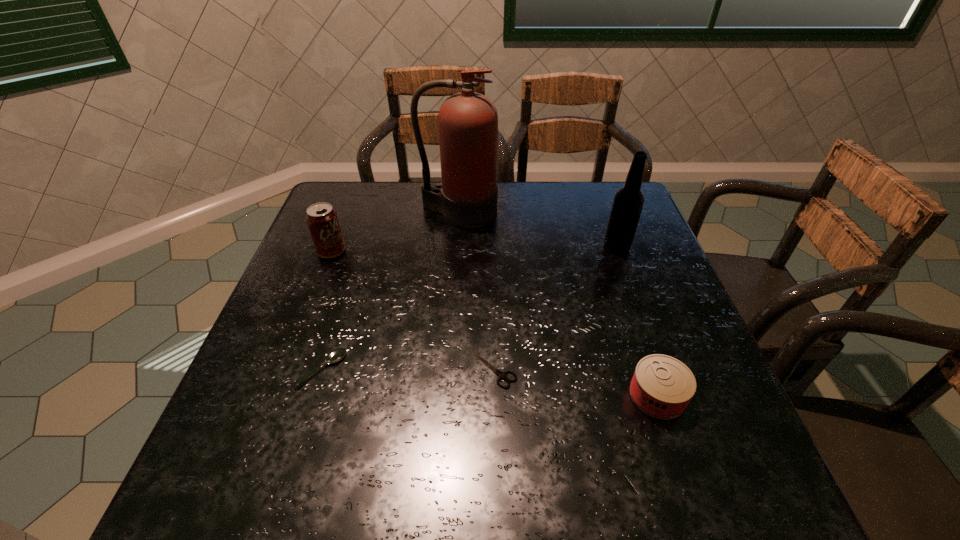
Where is `empty space between the third tallest object and the soupspoon`? empty space between the third tallest object and the soupspoon is located at coordinates (327, 310).

Locate an element on the screen. The height and width of the screenshot is (540, 960). vacant area that lies between the can and the third tallest object is located at coordinates (494, 323).

Locate an element on the screen. The image size is (960, 540). vacant area that lies between the can and the farthest object is located at coordinates (558, 303).

Where is `vacant space that's between the tallest object and the can`? vacant space that's between the tallest object and the can is located at coordinates (558, 303).

The width and height of the screenshot is (960, 540). What are the coordinates of `free space between the shortest object and the fourth tallest object` in the screenshot? It's located at (575, 382).

Where is `vacant space that is in between the soupspoon and the second tallest object`? vacant space that is in between the soupspoon and the second tallest object is located at coordinates (469, 308).

The height and width of the screenshot is (540, 960). I want to click on object that is the fifth closest to the fifth shortest object, so [322, 220].

Identify which object is located as the second nearest to the soupspoon. Please provide its 2D coordinates. Your answer should be formatted as a tuple, i.e. [(x, y)], where the tuple contains the x and y coordinates of a point satisfying the conditions above.

[(322, 220)]

Where is `blank area in the image that satisfies the following two spatial constraints: 1. on the front side of the shears; 2. on the left side of the third shortest object`? blank area in the image that satisfies the following two spatial constraints: 1. on the front side of the shears; 2. on the left side of the third shortest object is located at coordinates (494, 395).

Where is `vacant region that satisfies the following two spatial constraints: 1. on the front side of the soupspoon; 2. on the right side of the shears`? The height and width of the screenshot is (540, 960). vacant region that satisfies the following two spatial constraints: 1. on the front side of the soupspoon; 2. on the right side of the shears is located at coordinates (323, 369).